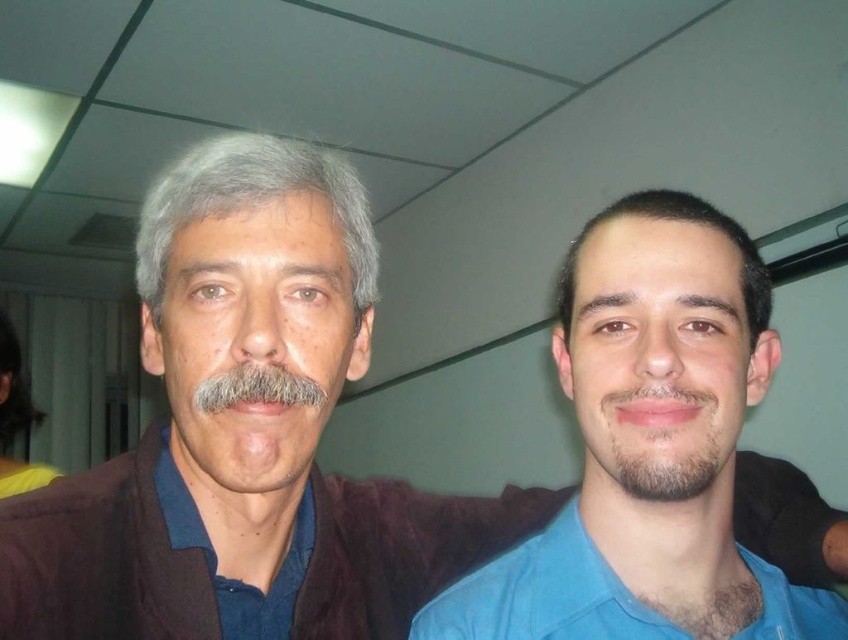
You are an office assistant who needs to distinguish between two blue shirts in the image. Which one is located to the left of the other? The two shirts are the blue matte shirt at right and the blue cotton shirt at right.

The blue matte shirt at right is positioned on the left side of the blue cotton shirt at right, so the blue matte shirt at right is to the left of the blue cotton shirt at right.

You are a photographer adjusting your camera settings. You need to focus on the dark brown hair at center and the brown fuzzy beard at lower center. Which of these two features is positioned more to the left side of the image?

The dark brown hair at center is positioned more to the left side of the image than the brown fuzzy beard at lower center.

You are an artist trying to sketch this scene. You notice the dark brown hair at center and the brown fuzzy beard at lower center. Which of these two features is wider in the image?

The dark brown hair at center is wider than the brown fuzzy beard at lower center according to the description.